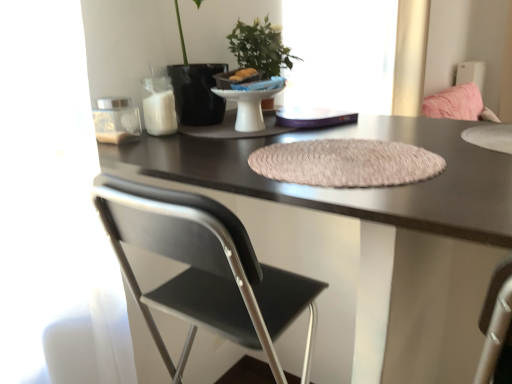
Question: Is point (320, 372) closer or farther from the camera than point (175, 372)?

Choices:
 (A) farther
 (B) closer

Answer: (A)

Question: From the image's perspective, is matte black desk at center positioned above or below black matte chair at center?

Choices:
 (A) above
 (B) below

Answer: (B)

Question: Which is nearer to the black matte chair at center?

Choices:
 (A) green matte plant at upper center
 (B) transparent glass window at upper center
 (C) beige textured placemat at center
 (D) matte black desk at center

Answer: (D)

Question: Which object is positioned farthest from the beige textured placemat at center?

Choices:
 (A) matte black desk at center
 (B) black matte chair at center
 (C) green matte plant at upper center
 (D) transparent glass window at upper center

Answer: (D)